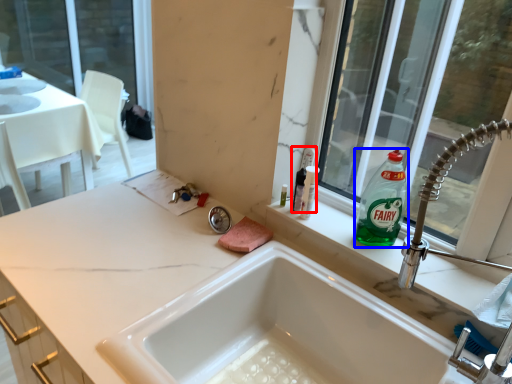
Question: Among these objects, which one is nearest to the camera, toiletry (highlighted by a red box) or cleaning product (highlighted by a blue box)?

Choices:
 (A) toiletry
 (B) cleaning product

Answer: (B)